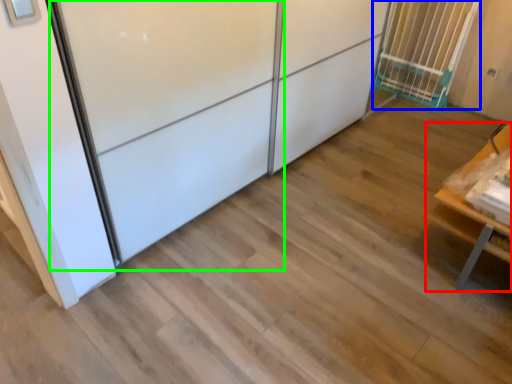
Question: Which object is positioned closest to furniture (highlighted by a red box)? Select from cage (highlighted by a blue box) and screen door (highlighted by a green box).

Choices:
 (A) cage
 (B) screen door

Answer: (B)